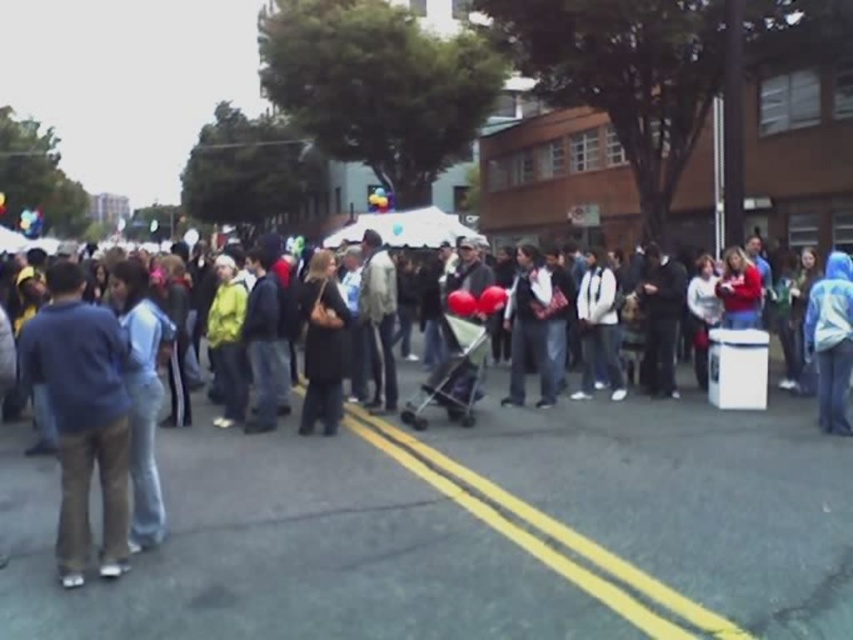
Question: Among these objects, which one is farthest from the camera?

Choices:
 (A) blue cotton shirt at left
 (B) dark blue jacket at center

Answer: (A)

Question: Which point appears farthest from the camera in this image?

Choices:
 (A) (108, 513)
 (B) (340, 323)

Answer: (B)

Question: Among these points, which one is nearest to the camera?

Choices:
 (A) (341, 349)
 (B) (105, 545)

Answer: (B)

Question: Is blue cotton shirt at left thinner than dark gray coat at center?

Choices:
 (A) yes
 (B) no

Answer: (A)

Question: Does blue cotton shirt at left appear on the left side of dark gray coat at center?

Choices:
 (A) no
 (B) yes

Answer: (B)

Question: Is dark blue jacket at center above blue cotton shirt at left?

Choices:
 (A) no
 (B) yes

Answer: (A)